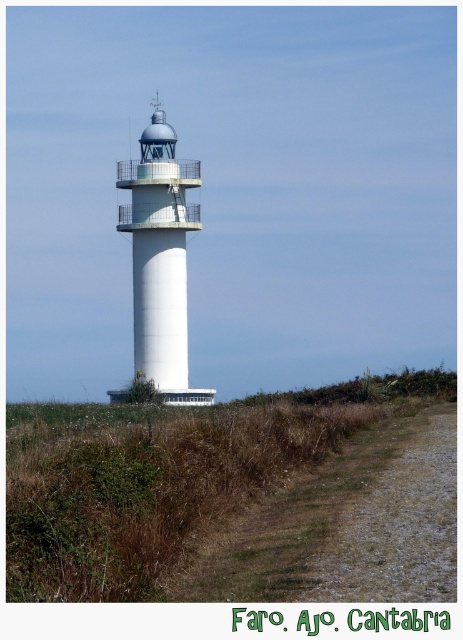
Does green grass at center have a greater height compared to white smooth lighthouse at center?

No, green grass at center is not taller than white smooth lighthouse at center.

Measure the distance from green grass at center to white smooth lighthouse at center.

The distance of green grass at center from white smooth lighthouse at center is 11.63 meters.

Is point (33, 580) positioned after point (156, 109)?

That is False.

The height and width of the screenshot is (640, 463). I want to click on green grass at center, so click(163, 476).